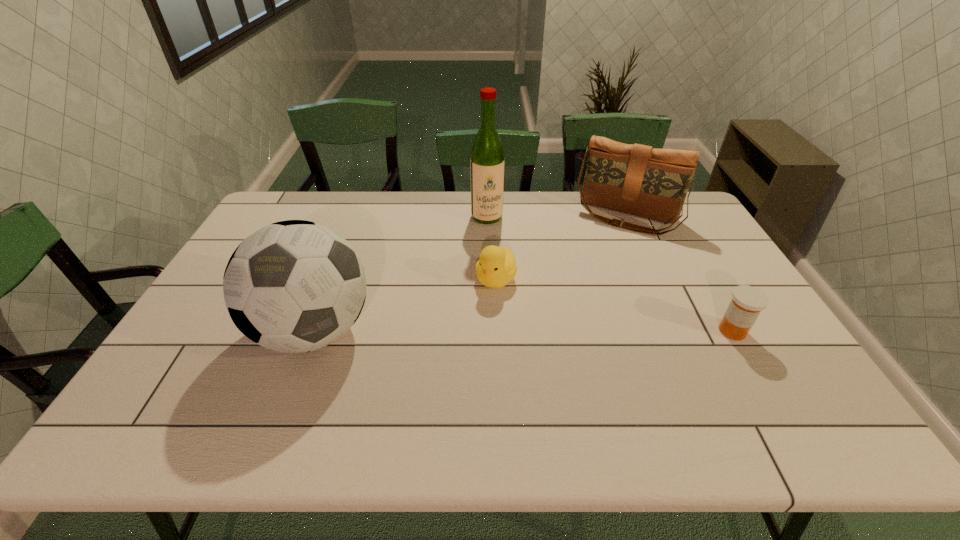
Where is `vacant spot on the desktop that is between the soccer ball and the medicine and is positioned on the label of the tallest object`? Image resolution: width=960 pixels, height=540 pixels. vacant spot on the desktop that is between the soccer ball and the medicine and is positioned on the label of the tallest object is located at coordinates (521, 331).

You are a GUI agent. You are given a task and a screenshot of the screen. Output one action in this format:
    pyautogui.click(x=<x>, y=<y>)
    Task: Click on the free space on the desktop that is between the second tallest object and the medicine and is positioned on the front-facing side of the third tallest object
    
    Given the screenshot: What is the action you would take?
    pyautogui.click(x=575, y=331)

This screenshot has width=960, height=540. I want to click on free spot on the desktop that is between the soccer ball and the medicine and is positioned on the front-facing side of the duck, so click(x=464, y=331).